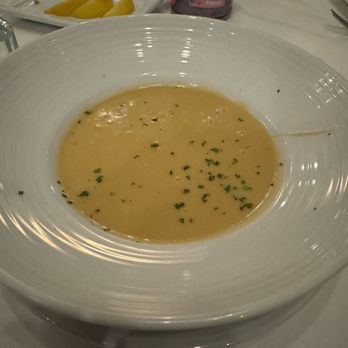
The image size is (348, 348). In order to click on drink glass in this screenshot , I will do `click(219, 11)`.